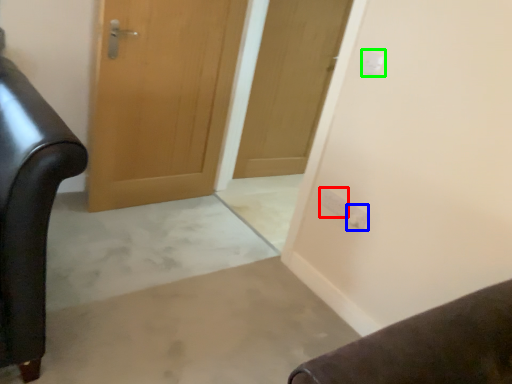
Question: Estimate the real-world distances between objects in this image. Which object is farther from electric outlet (highlighted by a red box), electric outlet (highlighted by a blue box) or electric outlet (highlighted by a green box)?

Choices:
 (A) electric outlet
 (B) electric outlet

Answer: (B)